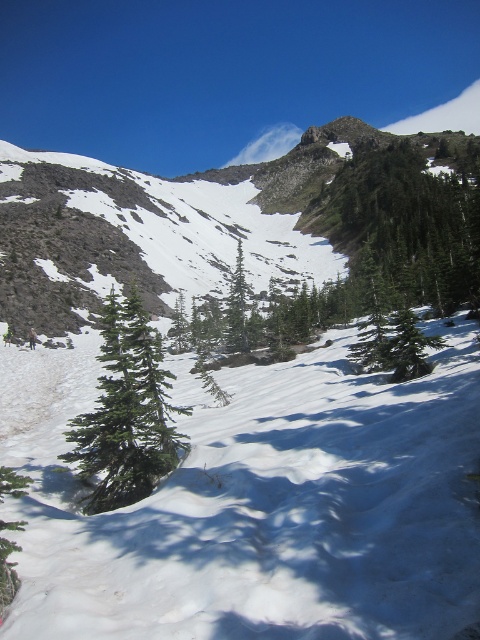
Can you confirm if white snow at center is positioned to the right of green matte tree at center?

Correct, you'll find white snow at center to the right of green matte tree at center.

Which is below, white snow at center or green matte tree at center?

Positioned lower is white snow at center.

The height and width of the screenshot is (640, 480). I want to click on white snow at center, so click(256, 504).

Who is lower down, green textured tree at upper center or green matte evergreen tree at center?

green matte evergreen tree at center is below.

Is green textured tree at upper center to the right of green matte evergreen tree at center from the viewer's perspective?

Correct, you'll find green textured tree at upper center to the right of green matte evergreen tree at center.

Between point (418, 170) and point (120, 461), which one is positioned behind?

Positioned behind is point (418, 170).

At what (x,y) coordinates should I click in order to perform the action: click on green textured tree at upper center. Please return your answer as a coordinate pair (x, y). Image resolution: width=480 pixels, height=640 pixels. Looking at the image, I should click on (407, 220).

Who is positioned more to the left, green textured tree at upper center or green matte tree at center?

Positioned to the left is green matte tree at center.

Looking at this image, which is above, green textured tree at upper center or green matte tree at center?

Positioned higher is green textured tree at upper center.

The height and width of the screenshot is (640, 480). Find the location of `green textured tree at upper center`. green textured tree at upper center is located at coordinates (407, 220).

You are a GUI agent. You are given a task and a screenshot of the screen. Output one action in this format:
    pyautogui.click(x=<x>, y=<y>)
    Task: Click on the green textured tree at upper center
    
    Given the screenshot: What is the action you would take?
    pyautogui.click(x=407, y=220)